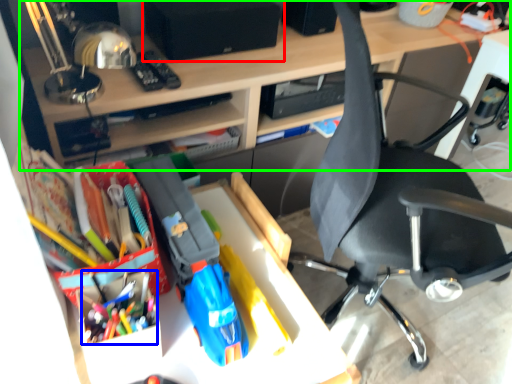
Question: Based on their relative distances, which object is nearer to speaker (highlighted by a red box)? Choose from stationery (highlighted by a blue box) and desk (highlighted by a green box).

Choices:
 (A) stationery
 (B) desk

Answer: (B)